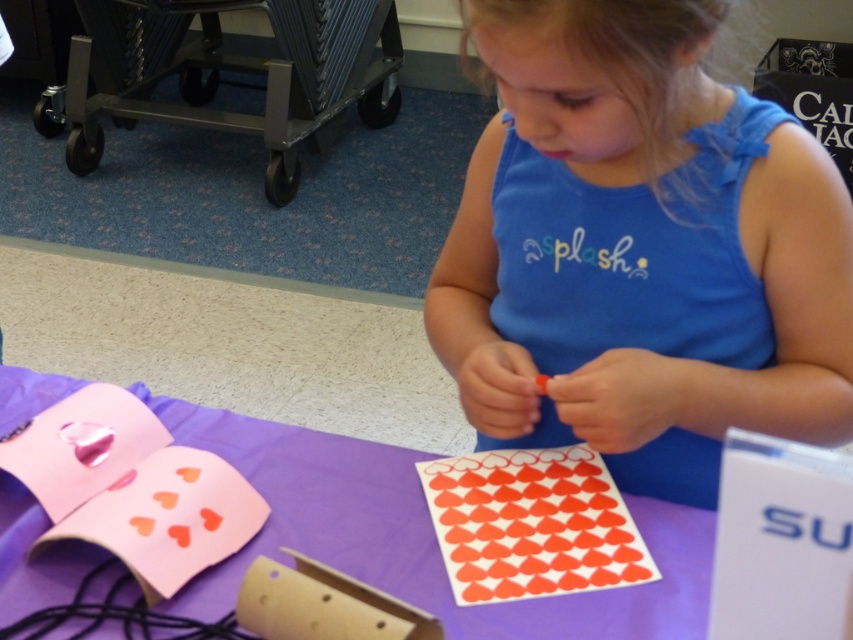
You are standing 10 feet away from the table where the child is working. Can you reach the point at coordinates (648, 179) without moving closer to the table?

The point at coordinates (648, 179) is 31.32 inches from the viewer. Since 10 feet is equal to 120 inches, the distance is greater than 31.32 inches, so you can reach it without moving closer.

You are a photographer trying to capture a closeup of the craft activity. The camera you are using has a minimum focusing distance of 60 centimeters. Can you take a clear photo of the purple fabric table at center without moving the camera closer?

The purple fabric table at center and camera are 64.80 centimeters apart. Since the minimum focusing distance is 60 centimeters, the camera can focus on the purple fabric table at center from this distance, so yes, you can take a clear photo without moving the camera closer.

The child is wearing a blue cotton shirt at center and has red glossy heart stickers at center on the table. Which item is taller?

The blue cotton shirt at center is taller than the red glossy heart stickers at center.